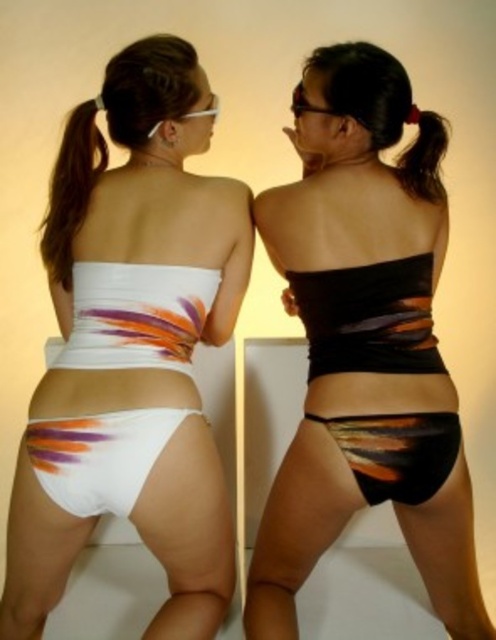
You are a photographer setting up for a photoshoot. You need to position a light source to the right of both the white matte bikini bottom at center and the white matte bikini bottom at lower left. Based on their positions, which bikini bottom should the light be placed to the right of?

The light should be placed to the right of the white matte bikini bottom at lower left because the white matte bikini bottom at center is to its right, so positioning the light further right would illuminate both.

Consider the image. You are a swimwear designer examining the image. You need to determine if the white matte bikini top at center and the shiny orange fabric bikini bottom at center can be paired together for a cohesive look. Considering their positions, is there enough space between them to allow for a comfortable fit when worn?

The white matte bikini top at center and shiny orange fabric bikini bottom at center are 16.55 inches apart from each other, which is a standard distance for a comfortable fit, so they can be paired together.